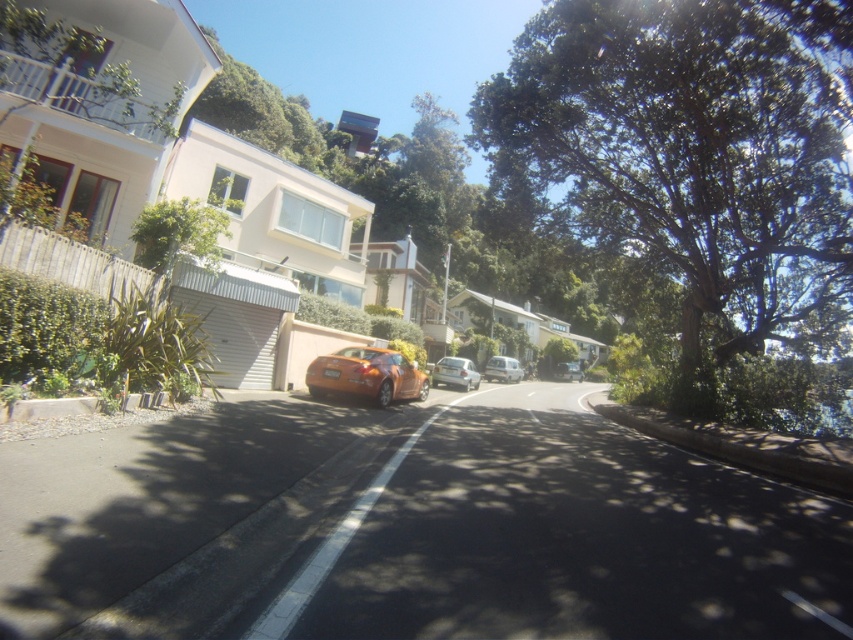
Does satin silver car at center appear on the left side of metallic silver car at center?

Yes, satin silver car at center is to the left of metallic silver car at center.

Is satin silver car at center in front of metallic silver car at center?

That is True.

This screenshot has height=640, width=853. What are the coordinates of `satin silver car at center` in the screenshot? It's located at (456, 372).

Who is positioned more to the right, silver metallic car at center or metallic silver car at center?

metallic silver car at center is more to the right.

Who is more forward, (511, 362) or (573, 372)?

Point (511, 362)

The image size is (853, 640). In order to click on silver metallic car at center in this screenshot , I will do (x=503, y=369).

Does green leafy tree at upper right have a larger size compared to metallic silver car at center?

Yes.

Does green leafy tree at upper right lie in front of metallic silver car at center?

Yes, green leafy tree at upper right is closer to the viewer.

Based on the photo, who is more forward, [608,184] or [561,380]?

Point [608,184]

What are the coordinates of `green leafy tree at upper right` in the screenshot? It's located at (697, 163).